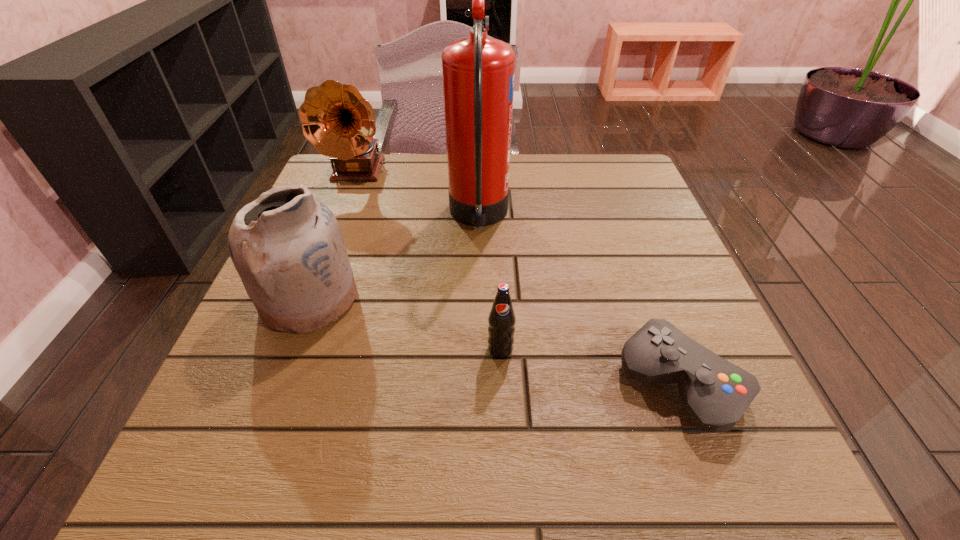
This screenshot has height=540, width=960. Identify the location of free space located on the left of the rightmost object. (398, 383).

Find the location of `fire extinguisher that is at the far edge`. fire extinguisher that is at the far edge is located at coordinates (478, 71).

Find the location of a particular element. phonograph_record that is at the far edge is located at coordinates (336, 119).

The width and height of the screenshot is (960, 540). Identify the location of object that is at the near edge. (715, 393).

Image resolution: width=960 pixels, height=540 pixels. What are the coordinates of `phonograph_record that is at the left edge` in the screenshot? It's located at (336, 119).

Find the location of a particular element. pottery located in the left edge section of the desktop is located at coordinates (287, 247).

Find the location of a particular element. The height and width of the screenshot is (540, 960). object located in the right edge section of the desktop is located at coordinates (715, 393).

Locate an element on the screen. This screenshot has height=540, width=960. object at the far left corner is located at coordinates (336, 119).

Find the location of a particular element. Image resolution: width=960 pixels, height=540 pixels. object positioned at the near right corner is located at coordinates (715, 393).

The width and height of the screenshot is (960, 540). Identify the location of blank area at the far edge. (440, 183).